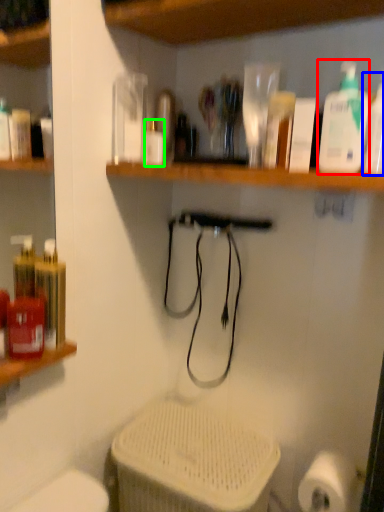
Question: Which is nearer to the cleaning product (highlighted by a red box)? cleaning product (highlighted by a blue box) or bottle (highlighted by a green box).

Choices:
 (A) cleaning product
 (B) bottle

Answer: (A)